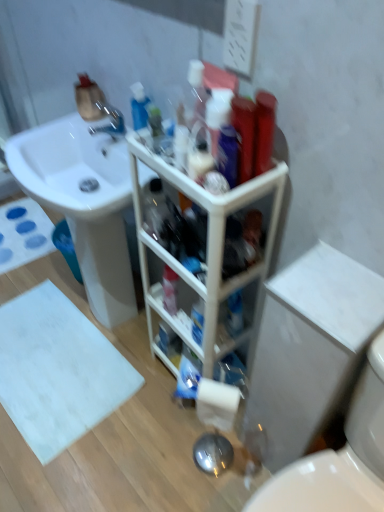
The image size is (384, 512). In order to click on vacant space in white matte bath mat at lower left, which is the 1th bath mat in bottom-to-top order (from a real-world perspective) in this screenshot , I will do `click(40, 362)`.